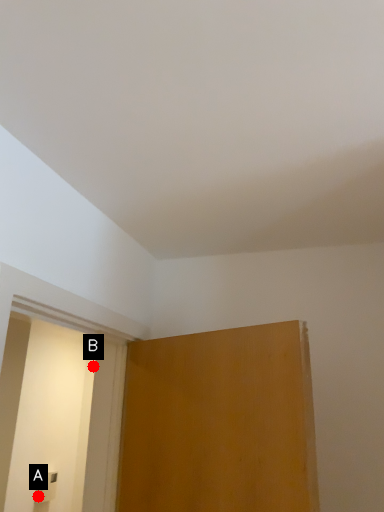
Question: Two points are circled on the image, labeled by A and B beside each circle. Which of the following is the closest to the observer?

Choices:
 (A) A is closer
 (B) B is closer

Answer: (A)